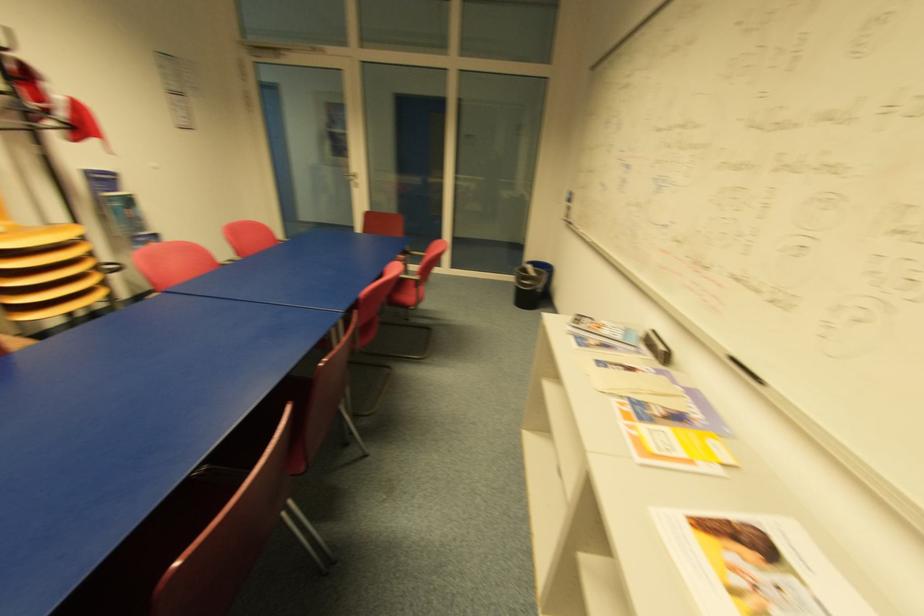
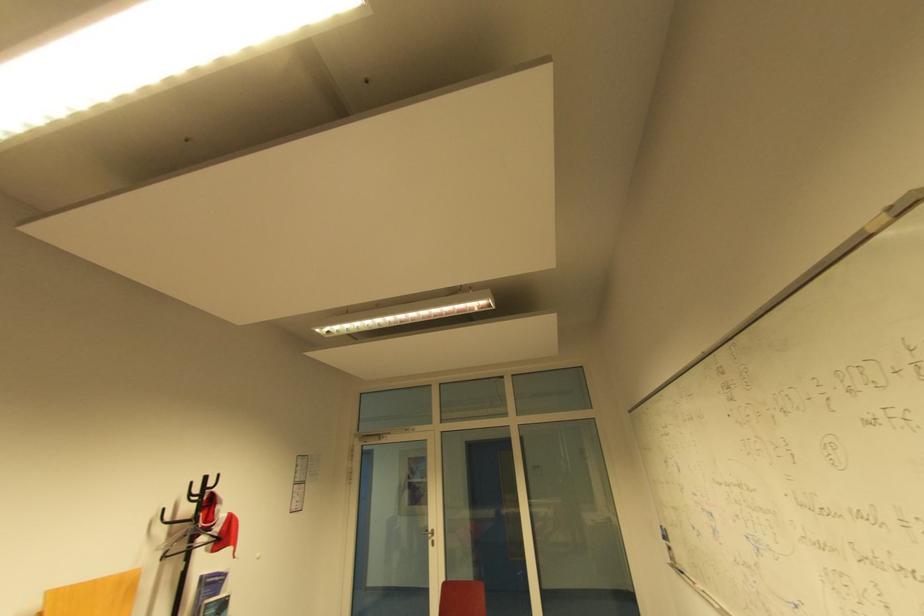
Locate, in the second image, the point that corresponds to pixel 84 108 in the first image.

(235, 521)